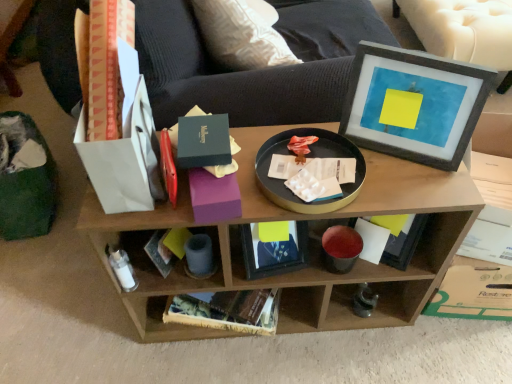
Find the location of a particular element. This screenshot has width=512, height=384. vacant area in front of matte gray picture frame at upper right is located at coordinates (414, 188).